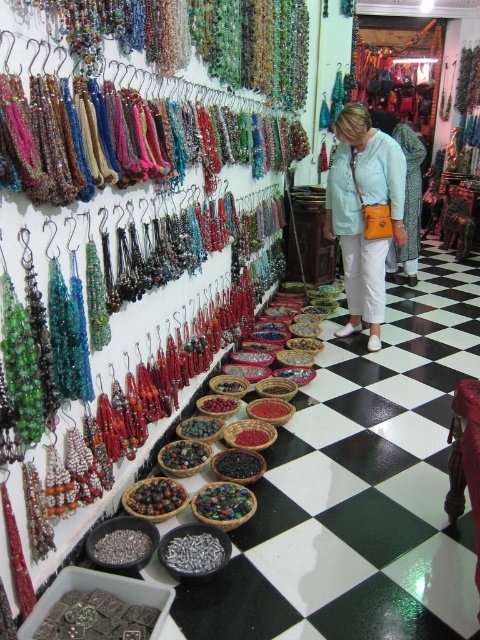
You are a customer in the jewelry shop and want to try on the silver metallic bracelet at center. You notice a light blue fabric shirt at center nearby. Which item is wider?

The light blue fabric shirt at center is wider than the silver metallic bracelet at center.

You are a customer in the jewelry shop and see the light blue fabric shirt at center and the silver metallic bracelet at center. Which item is taller?

The light blue fabric shirt at center is much taller than the silver metallic bracelet at center.

You are a customer in the jewelry shop and want to place the silver metallic bracelet at center onto the light blue fabric shirt at center. Will the bracelet fit on the shirt?

The light blue fabric shirt at center is bigger than the silver metallic bracelet at center, so the bracelet can fit on the shirt.